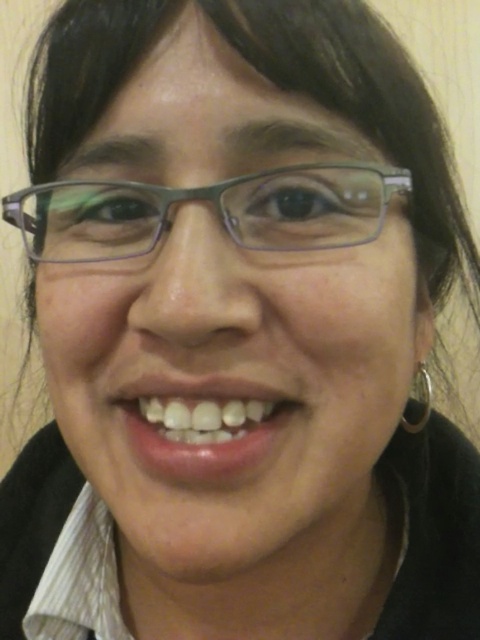
How much distance is there between matte gray glasses at center and glossy pink lips at center?

matte gray glasses at center and glossy pink lips at center are 3.29 inches apart.

Does matte gray glasses at center appear on the right side of glossy pink lips at center?

No, matte gray glasses at center is not to the right of glossy pink lips at center.

Who is more forward, (350, 182) or (156, 378)?

Point (156, 378) is in front.

Identify the location of matte gray glasses at center. The image size is (480, 640). (215, 205).

Can you confirm if glossy pink lips at center is thinner than silver metallic hoop at right?

Incorrect, glossy pink lips at center's width is not less than silver metallic hoop at right's.

Find the location of a particular element. glossy pink lips at center is located at coordinates (201, 426).

Locate an element on the screen. The image size is (480, 640). glossy pink lips at center is located at coordinates (201, 426).

Is matte gray glasses at center below silver metallic hoop at right?

No, matte gray glasses at center is not below silver metallic hoop at right.

Can you confirm if matte gray glasses at center is thinner than silver metallic hoop at right?

In fact, matte gray glasses at center might be wider than silver metallic hoop at right.

Is point (307, 232) more distant than point (420, 369)?

No, it is not.

This screenshot has height=640, width=480. What are the coordinates of `matte gray glasses at center` in the screenshot? It's located at (215, 205).